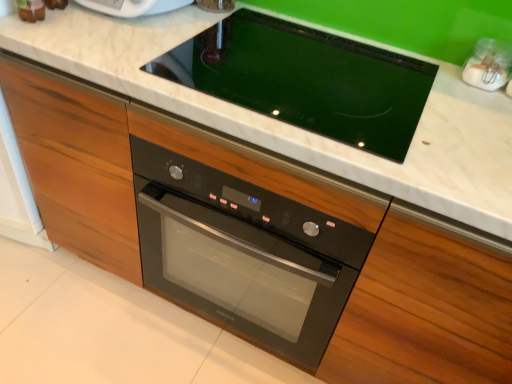
Locate an element on the screen. free space above white marble countertop at center (from a real-world perspective) is located at coordinates (303, 72).